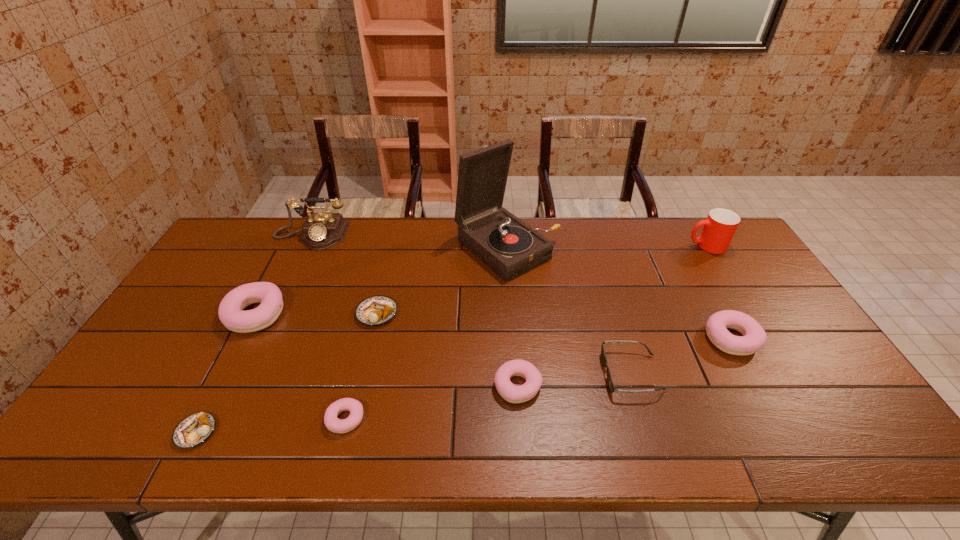
Locate an element on the screen. the tallest object is located at coordinates click(x=506, y=244).

Locate an element on the screen. The height and width of the screenshot is (540, 960). telephone is located at coordinates (322, 230).

Identify the location of black telephone. Image resolution: width=960 pixels, height=540 pixels. (322, 230).

Locate an element on the screen. the third tallest object is located at coordinates (719, 228).

I want to click on cup, so click(x=719, y=228).

This screenshot has width=960, height=540. I want to click on the leftmost pink pastry, so click(x=230, y=312).

At what (x,y) coordinates should I click in order to perform the action: click on the tallest pastry. Please return your answer as a coordinate pair (x, y). This screenshot has width=960, height=540. Looking at the image, I should click on (230, 312).

Locate an element on the screen. The width and height of the screenshot is (960, 540). the third smallest pink pastry is located at coordinates (754, 337).

Locate an element on the screen. This screenshot has width=960, height=540. the rightmost pastry is located at coordinates (754, 337).

Identify the location of the fifth pastry from left to right. The image size is (960, 540). (512, 393).